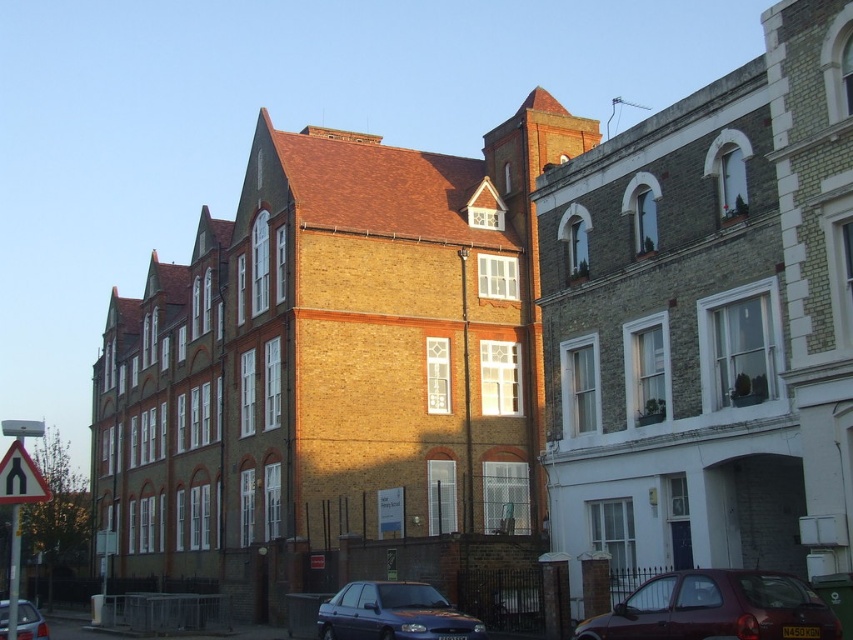
Question: Among these objects, which one is nearest to the camera?

Choices:
 (A) metallic blue car at lower left
 (B) maroon metallic hatchback at lower right

Answer: (B)

Question: Can you confirm if maroon metallic hatchback at lower right is wider than white plastic road sign at lower left?

Choices:
 (A) no
 (B) yes

Answer: (A)

Question: Does maroon metallic hatchback at lower right have a smaller size compared to metallic blue car at lower left?

Choices:
 (A) yes
 (B) no

Answer: (B)

Question: Can you confirm if metallic blue sedan at lower center is smaller than white plastic road sign at lower left?

Choices:
 (A) no
 (B) yes

Answer: (B)

Question: Which point is closer to the camera?

Choices:
 (A) (x=782, y=628)
 (B) (x=467, y=628)
 (C) (x=19, y=484)

Answer: (A)

Question: Which of the following is the farthest from the observer?

Choices:
 (A) white plastic road sign at lower left
 (B) metallic blue car at lower left

Answer: (B)